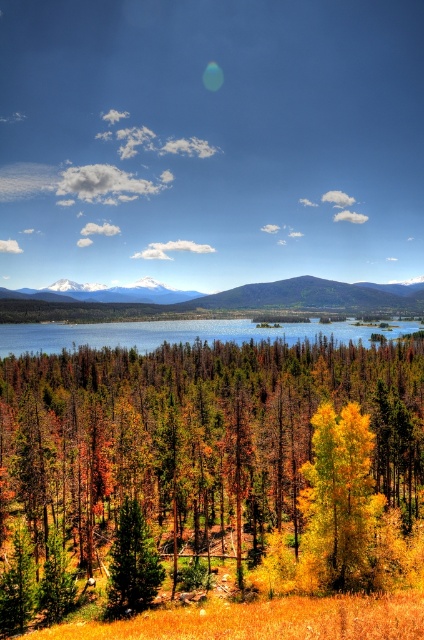
You are an environmental scientist assessing the ecological balance of this landscape. You notice the yellow matte tree at center and the clear blue water at center. Based on their sizes, which one might require more space for sustainable growth or maintenance?

The yellow matte tree at center has a lesser width compared to the clear blue water at center, so the tree might require more space for sustainable growth as it currently has a narrower spread.

You are a hiker who wants to cross from the yellow matte tree at center to the clear blue water at center. Given that you can walk 1.5 meters per second, how many seconds will it take you to reach the water if you walk directly towards it?

The yellow matte tree at center and clear blue water at center are 158.94 meters apart. At a walking speed of 1.5 meters per second, it would take approximately 105.96 seconds to reach the water.